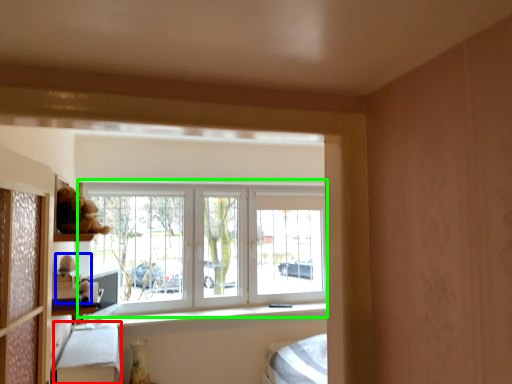
Question: Which object is positioned closest to bed frame (highlighted by a red box)? Select from toy (highlighted by a blue box) and window (highlighted by a green box).

Choices:
 (A) toy
 (B) window

Answer: (A)